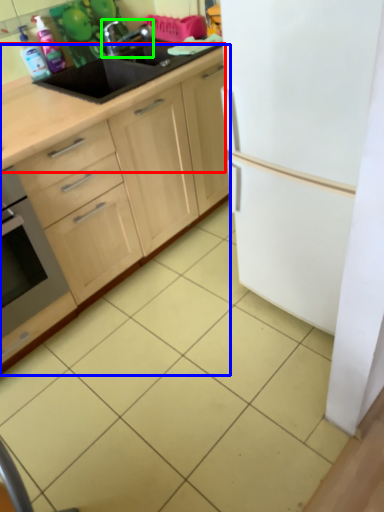
Question: Which is nearer to the countertop (highlighted by a red box)? cabinetry (highlighted by a blue box) or tap (highlighted by a green box).

Choices:
 (A) cabinetry
 (B) tap

Answer: (A)